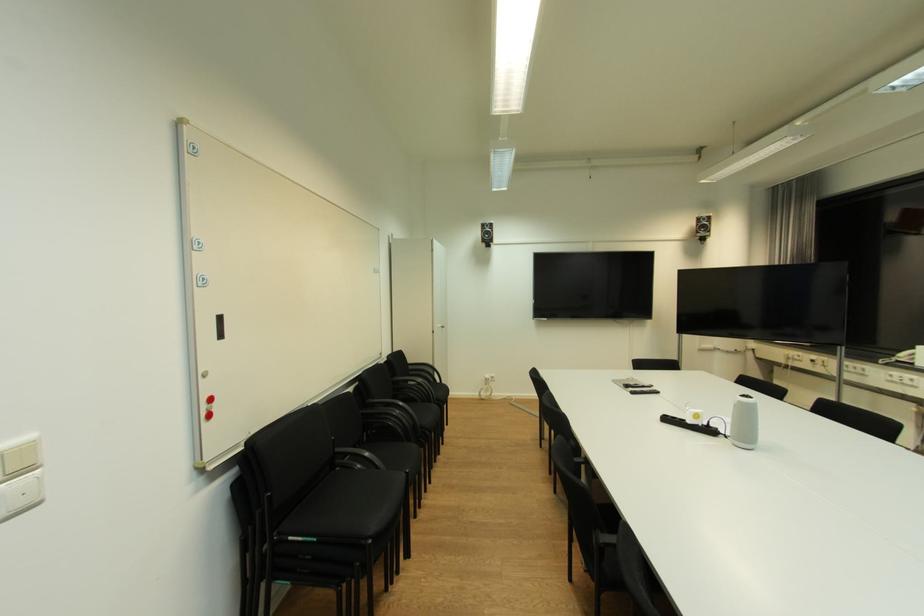
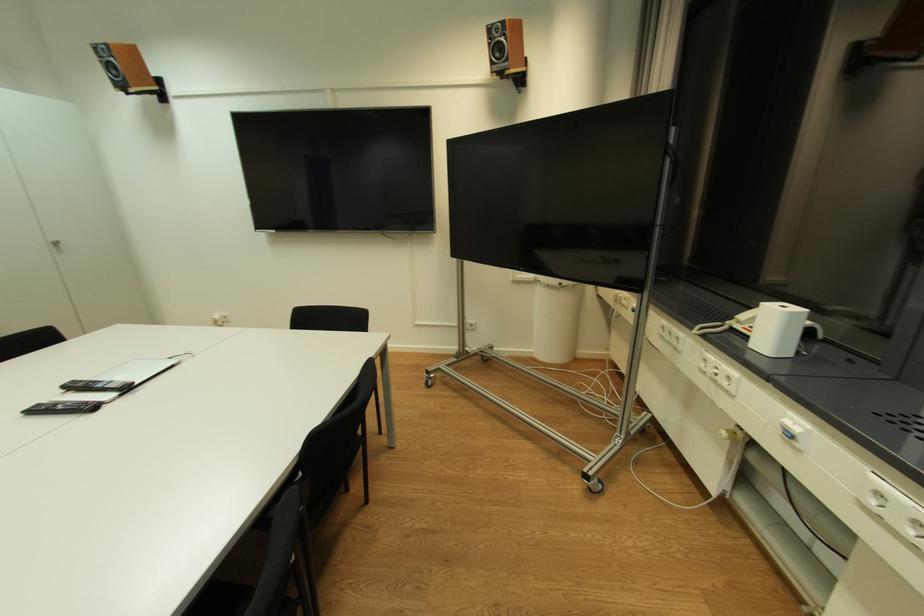
Locate, in the second image, the point that corresponds to the point at 723,355 in the first image.

(544, 290)